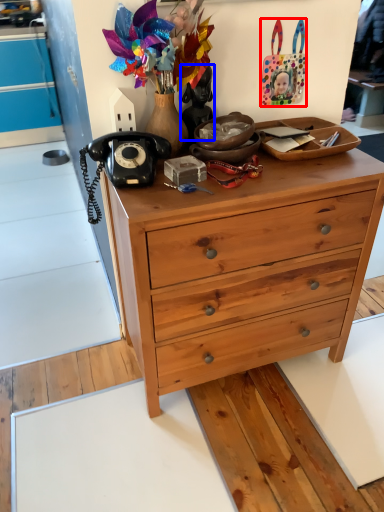
Question: Which object appears closest to the camera in this image, handbag (highlighted by a red box) or person (highlighted by a blue box)?

Choices:
 (A) handbag
 (B) person

Answer: (B)